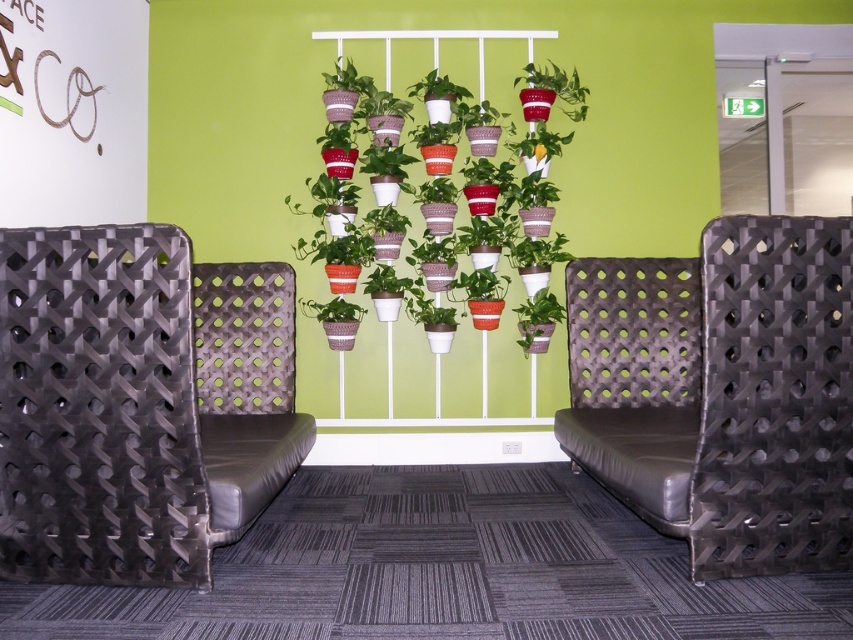
You are moving a 1.5 meter wide sofa into the space between the black woven fabric chair at left and the black leather chair at center. Can the sofa fit through the space between them?

The distance between the black woven fabric chair at left and the black leather chair at center is 1.63 meters. Since the sofa is 1.5 meters wide, it can fit through the space as there is enough clearance.

You are arranging a meeting in this space and need to place a laptop on a surface. The black woven fabric chair at left has a seat that can hold the laptop, but you want to ensure it won not block the view of the matte red pot at upper center. Is the current position of the chair suitable for this purpose?

The black woven fabric chair at left is positioned on the left side of the matte red pot at upper center. Since the chair is to the left of the pot, placing the laptop on the chair seat would not obstruct the view of the matte red pot at upper center as they are aligned horizontally.